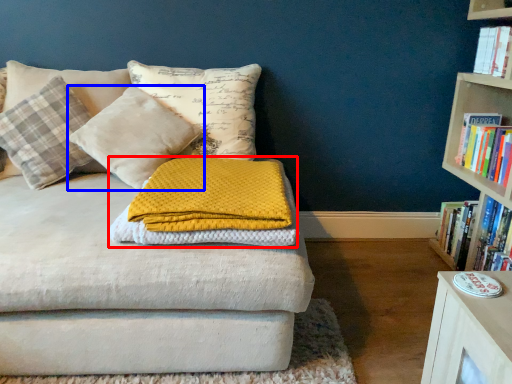
Question: Among these objects, which one is nearest to the camera, blanket (highlighted by a red box) or pillow (highlighted by a blue box)?

Choices:
 (A) blanket
 (B) pillow

Answer: (A)